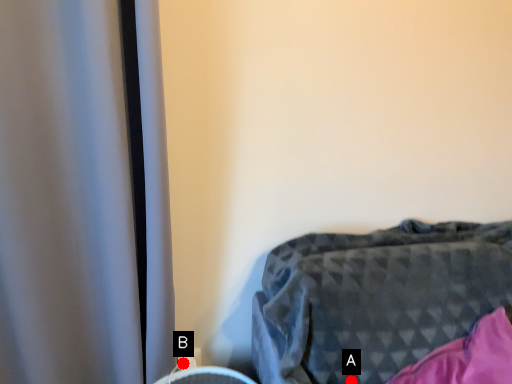
Question: Two points are circled on the image, labeled by A and B beside each circle. Which point is further to the camera?

Choices:
 (A) A is further
 (B) B is further

Answer: (B)